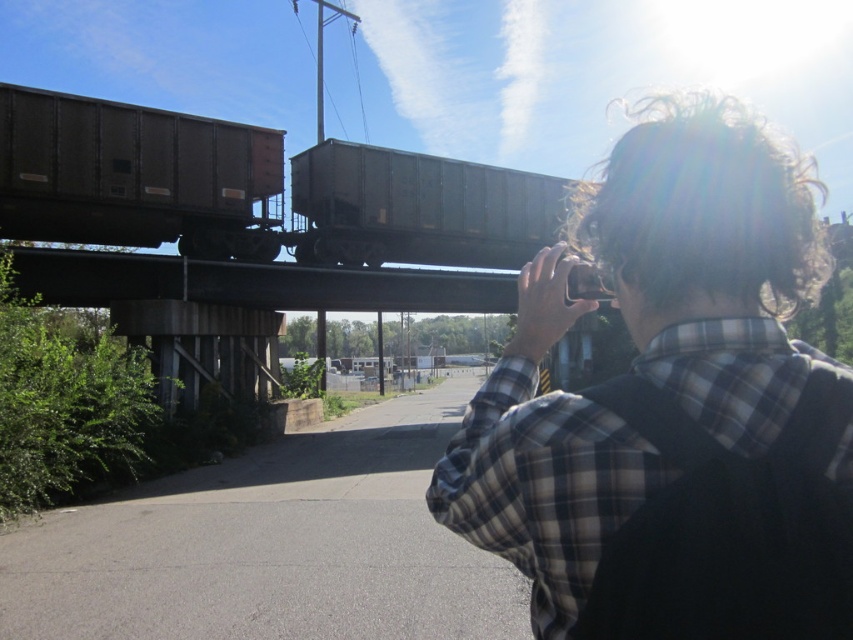
Who is more distant from viewer, (734,445) or (279,182)?

The point (279,182) is more distant.

Which of these two, plaid shirt at upper right or brown matte train car at left, stands shorter?

Standing shorter between the two is brown matte train car at left.

Is point (503, 390) positioned behind point (271, 176)?

No, it is in front of (271, 176).

Identify the location of plaid shirt at upper right. The height and width of the screenshot is (640, 853). (711, 260).

The image size is (853, 640). Describe the element at coordinates (253, 189) in the screenshot. I see `dark gray metal train car at upper center` at that location.

Does dark gray metal train car at upper center have a greater width compared to brown matte train car at left?

Yes, dark gray metal train car at upper center is wider than brown matte train car at left.

From the picture: Who is more distant from viewer, (86, 170) or (68, 97)?

The point (86, 170) is behind.

Locate an element on the screen. The height and width of the screenshot is (640, 853). dark gray metal train car at upper center is located at coordinates (253, 189).

Which of these two, plaid shirt at upper right or dark gray metal train car at upper center, stands shorter?

Standing shorter between the two is dark gray metal train car at upper center.

Can you confirm if plaid shirt at upper right is thinner than dark gray metal train car at upper center?

Indeed, plaid shirt at upper right has a lesser width compared to dark gray metal train car at upper center.

Between point (560, 444) and point (3, 115), which one is positioned behind?

The point (3, 115) is behind.

At what (x,y) coordinates should I click in order to perform the action: click on plaid shirt at upper right. Please return your answer as a coordinate pair (x, y). The width and height of the screenshot is (853, 640). Looking at the image, I should click on click(x=711, y=260).